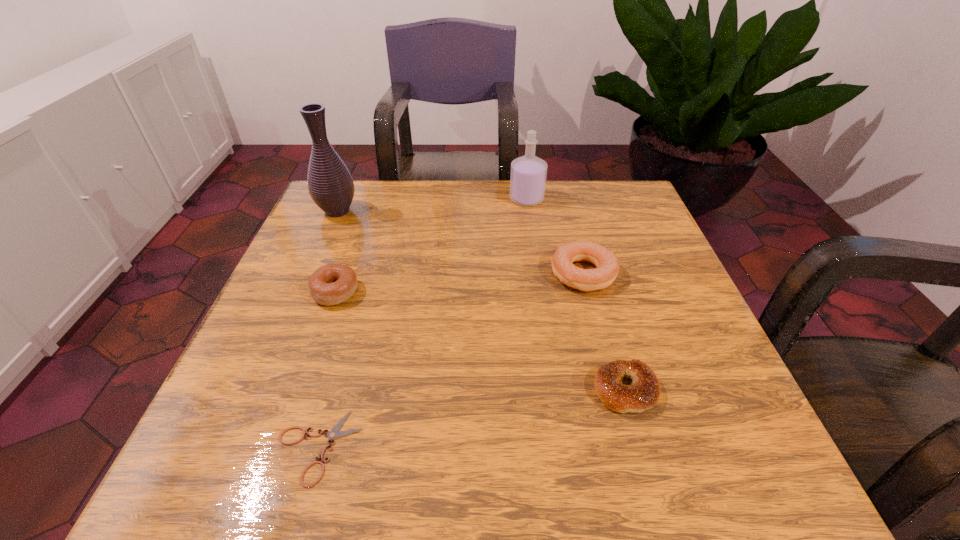
Where is `vacant position located on the right of the shortest object`? The height and width of the screenshot is (540, 960). vacant position located on the right of the shortest object is located at coordinates (522, 447).

Where is `vase located at the far edge`? vase located at the far edge is located at coordinates (330, 184).

The image size is (960, 540). What are the coordinates of `perfume present at the far edge` in the screenshot? It's located at (528, 174).

You are a GUI agent. You are given a task and a screenshot of the screen. Output one action in this format:
    pyautogui.click(x=<x>, y=<y>)
    Task: Click on the object at the near edge
    Image resolution: width=960 pixels, height=540 pixels.
    Given the screenshot: What is the action you would take?
    pyautogui.click(x=334, y=433)

Locate an element on the screen. vase present at the left edge is located at coordinates tap(330, 184).

Locate an element on the screen. The height and width of the screenshot is (540, 960). bagel that is positioned at the left edge is located at coordinates click(x=331, y=284).

Where is `shears that is positioned at the left edge`? The width and height of the screenshot is (960, 540). shears that is positioned at the left edge is located at coordinates (334, 433).

Identify the location of object situated at the far left corner. (330, 184).

The height and width of the screenshot is (540, 960). I want to click on object that is at the near left corner, so click(x=334, y=433).

The image size is (960, 540). Identify the location of free space at the far edge of the desktop. (535, 214).